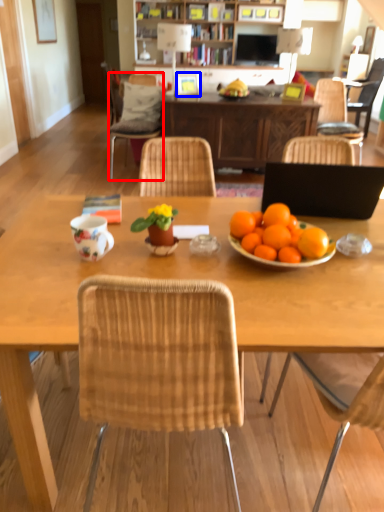
Question: Which object is further to the camera taking this photo, chair (highlighted by a red box) or picture frame (highlighted by a blue box)?

Choices:
 (A) chair
 (B) picture frame

Answer: (B)